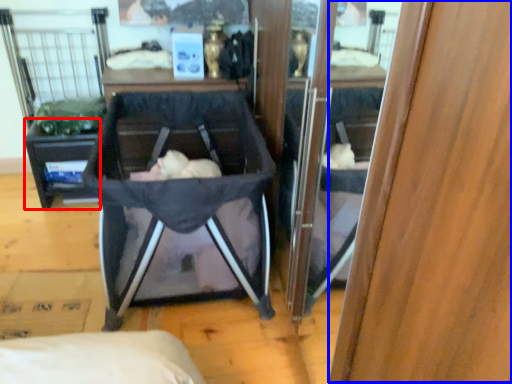
Question: Which object appears farthest to the camera in this image, vanity (highlighted by a red box) or wood (highlighted by a blue box)?

Choices:
 (A) vanity
 (B) wood

Answer: (A)